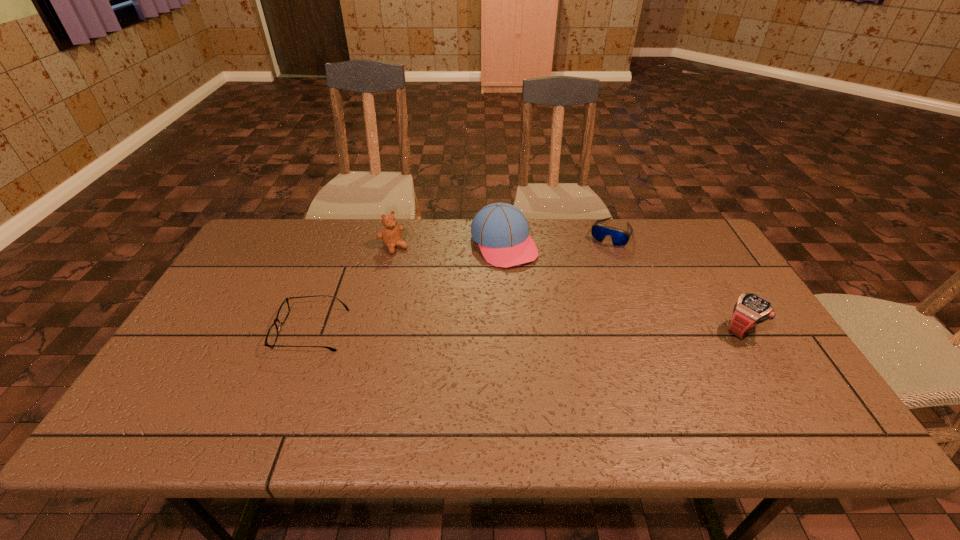
Locate an element on the screen. Image resolution: width=960 pixels, height=540 pixels. blank area in the image that satisfies the following two spatial constraints: 1. on the front side of the second object from left to right; 2. on the left side of the watch is located at coordinates (373, 329).